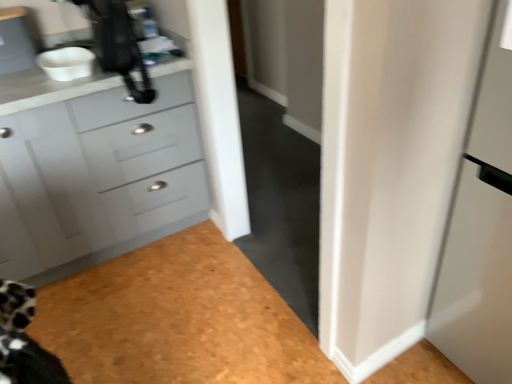
The image size is (512, 384). I want to click on vacant area that is situated to the right of matte gray cabinet at left, so click(x=251, y=225).